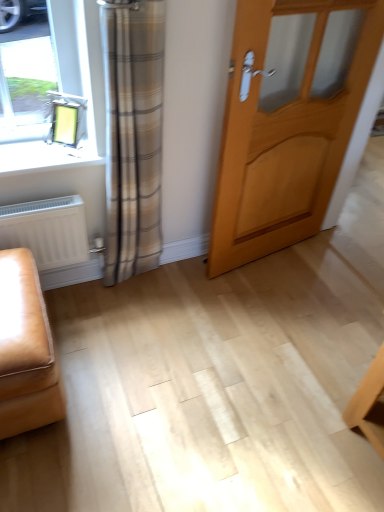
Find the location of a particular element. The width and height of the screenshot is (384, 512). free spot behind leather ottoman at lower left is located at coordinates (98, 316).